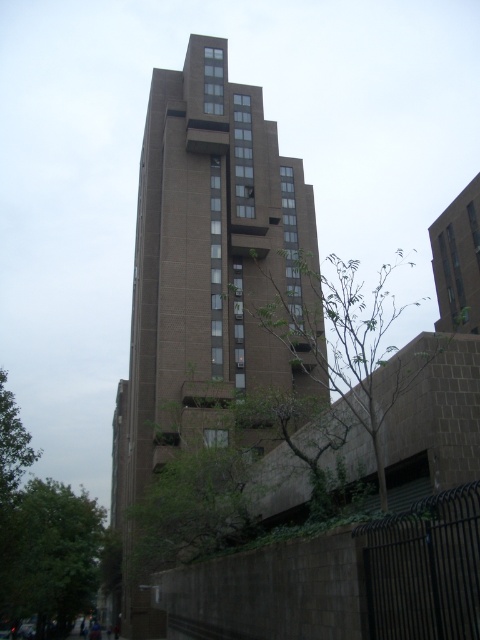
You are standing at the point marked by coordinates point (204, 282). Based on the scene description, what structure are you directly in front of?

You are directly in front of the brown concrete building at center, as the point (204, 282) represents its location.

Based on the scene description, what are the coordinates of the brown concrete building at center?

The brown concrete building at center is located at coordinates point (x=204, y=282).

You are standing in front of the building and notice two green leafy trees. Which tree, the green leafy tree at center or the green leafy tree at lower left, is positioned higher from the ground?

The green leafy tree at center is positioned higher from the ground than the green leafy tree at lower left.